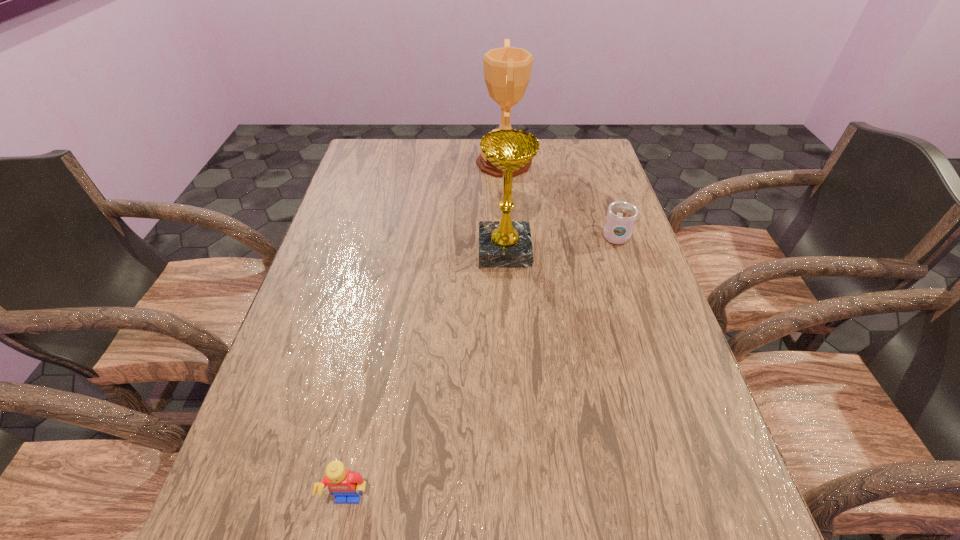
Find the location of a particular element. The height and width of the screenshot is (540, 960). vacant space located on the front-facing side of the nearer award is located at coordinates (460, 250).

The image size is (960, 540). Find the location of `vacant space located on the front-facing side of the nearer award`. vacant space located on the front-facing side of the nearer award is located at coordinates (352, 250).

You are a GUI agent. You are given a task and a screenshot of the screen. Output one action in this format:
    pyautogui.click(x=<x>, y=<y>)
    Task: Click on the vacant space positioned 0.070m on the side with the handle of the rightmost object
    The image size is (960, 540).
    Given the screenshot: What is the action you would take?
    pyautogui.click(x=606, y=208)

Identify the location of free point located 0.100m on the side with the handle of the rightmost object. [603, 202].

What are the coordinates of `vacant space located on the side with the handle of the rightmost object` in the screenshot? It's located at (592, 168).

Where is `object present at the far edge`? The height and width of the screenshot is (540, 960). object present at the far edge is located at coordinates (507, 70).

You are a GUI agent. You are given a task and a screenshot of the screen. Output one action in this format:
    pyautogui.click(x=<x>, y=<y>)
    Task: Click on the object present at the right edge
    
    Given the screenshot: What is the action you would take?
    pyautogui.click(x=621, y=216)

Where is `vacant space at the far edge of the desktop`? vacant space at the far edge of the desktop is located at coordinates [467, 138].

At what (x,y) coordinates should I click in order to perform the action: click on vacant space at the left edge of the desktop. Please return your answer as a coordinate pair (x, y). Looking at the image, I should click on tap(349, 295).

The width and height of the screenshot is (960, 540). I want to click on free location at the right edge of the desktop, so click(628, 255).